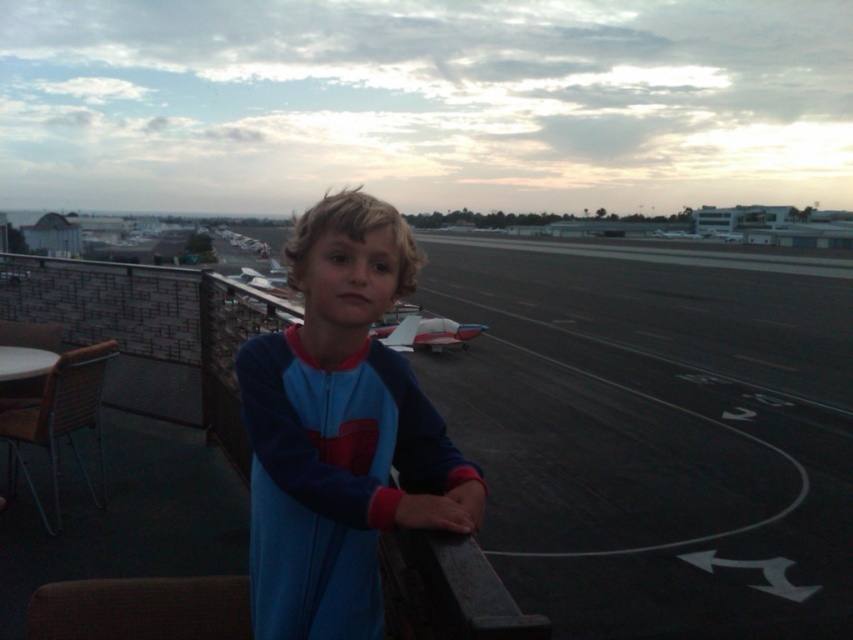
Question: Does black asphalt tarmac at center appear over red and white plastic airplane at center?

Choices:
 (A) yes
 (B) no

Answer: (A)

Question: Which point is farther to the camera?

Choices:
 (A) (795, 490)
 (B) (460, 337)
 (C) (245, 413)

Answer: (B)

Question: Which point is farther to the camera?

Choices:
 (A) (421, 342)
 (B) (334, 509)
 (C) (662, 237)

Answer: (C)

Question: Does blue fleece at center appear on the right side of white matte airplane at center?

Choices:
 (A) no
 (B) yes

Answer: (A)

Question: Which object is positioned farthest from the blue fleece at center?

Choices:
 (A) red and white plastic airplane at center
 (B) white matte airplane at center

Answer: (B)

Question: Can you confirm if blue fleece at center is thinner than white matte airplane at center?

Choices:
 (A) no
 (B) yes

Answer: (B)